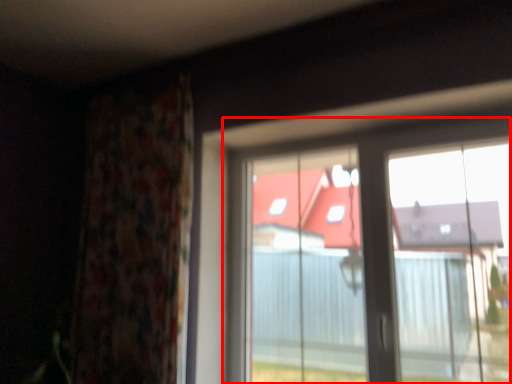
Question: From the image's perspective, where is window (annotated by the red box) located relative to curtain?

Choices:
 (A) above
 (B) below

Answer: (B)